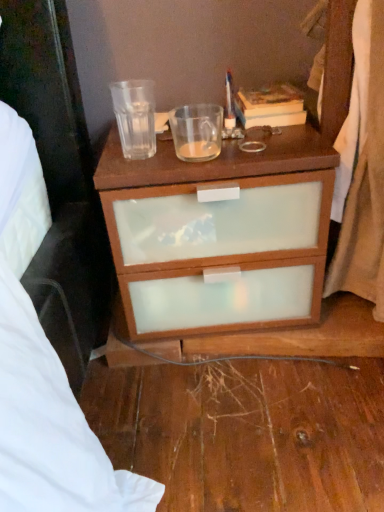
The width and height of the screenshot is (384, 512). In order to click on unoccupied area in front of hardcover book at upper right in this screenshot , I will do `click(258, 136)`.